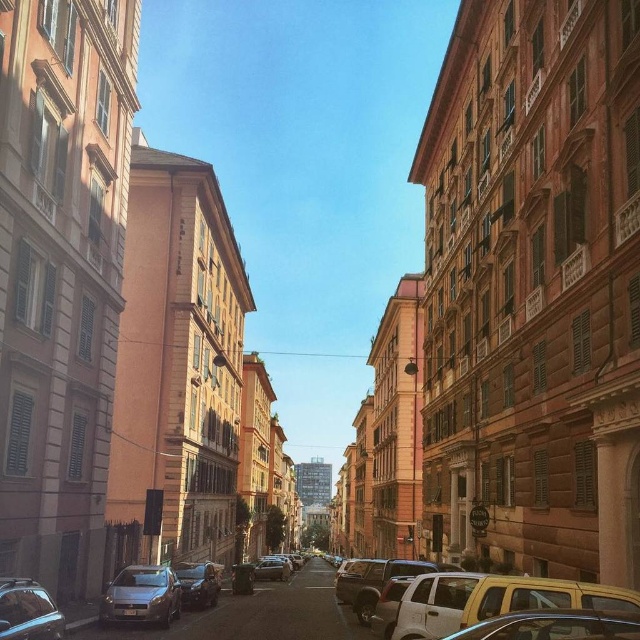
Does shiny black car at lower left have a lesser height compared to matte black car at center?

Indeed, shiny black car at lower left has a lesser height compared to matte black car at center.

What do you see at coordinates (28, 611) in the screenshot?
I see `shiny black car at lower left` at bounding box center [28, 611].

You are a GUI agent. You are given a task and a screenshot of the screen. Output one action in this format:
    pyautogui.click(x=<x>, y=<y>)
    Task: Click on the shiny black car at lower left
    This screenshot has width=640, height=640.
    Given the screenshot: What is the action you would take?
    pyautogui.click(x=28, y=611)

Does yellow matte van at lower right have a lesser width compared to matte black car at center?

Correct, yellow matte van at lower right's width is less than matte black car at center's.

Is yellow matte van at lower right below matte black car at center?

No.

You are a GUI agent. You are given a task and a screenshot of the screen. Output one action in this format:
    pyautogui.click(x=<x>, y=<y>)
    Task: Click on the yellow matte van at lower right
    The width and height of the screenshot is (640, 640).
    Given the screenshot: What is the action you would take?
    pyautogui.click(x=541, y=596)

Can you confirm if yellow matte van at lower right is positioned above shiny black car at lower left?

Correct, yellow matte van at lower right is located above shiny black car at lower left.

Is point (506, 598) less distant than point (24, 630)?

Yes, it is in front of point (24, 630).

Image resolution: width=640 pixels, height=640 pixels. I want to click on yellow matte van at lower right, so click(541, 596).